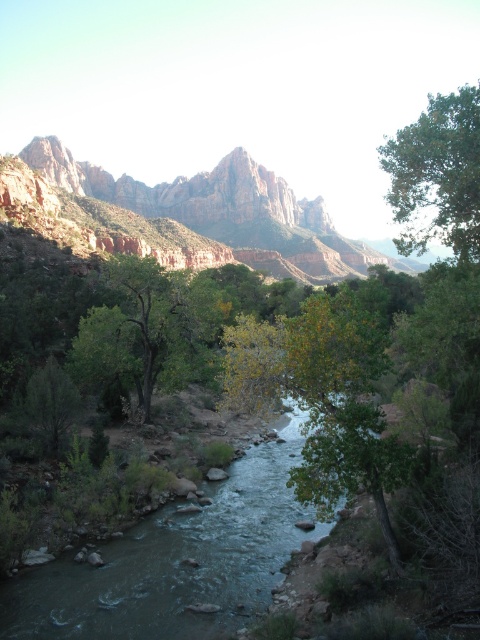
You are a hiker planning to cross the river using a narrow path that runs between the green leafy tree at center and the green leafy tree at upper right. The path is exactly 30 meters long. Will you be able to reach the other side of the river before the path ends?

The distance between the green leafy tree at center and the green leafy tree at upper right is 36.87 meters. Since the path is only 30 meters long, you will not be able to reach the other side of the river before the path ends.

Looking at this image, you are standing at the riverbank and want to cross the river using a small boat. There are two points marked on the river surface where you can land. The first landing point is at point [347,259], and the second is at point [169,381]. Which landing point is closer to your current position?

Point [347,259] is further to the camera than point [169,381]. Therefore, the landing point at point [169,381] is closer to your current position.